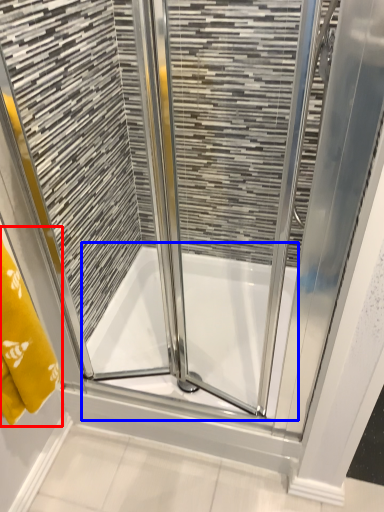
Question: Which point is further to the camera, bath towel (highlighted by a red box) or bath (highlighted by a blue box)?

Choices:
 (A) bath towel
 (B) bath

Answer: (B)